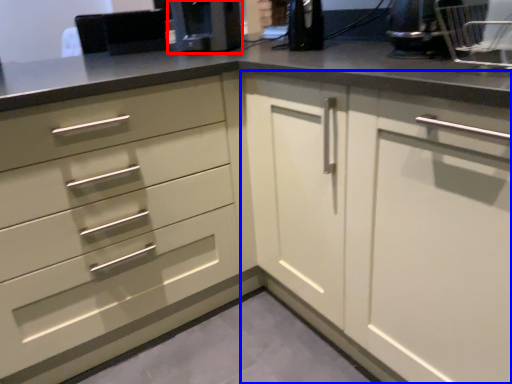
Question: Which object is further to the camera taking this photo, coffee machine (highlighted by a red box) or cabinetry (highlighted by a blue box)?

Choices:
 (A) coffee machine
 (B) cabinetry

Answer: (A)